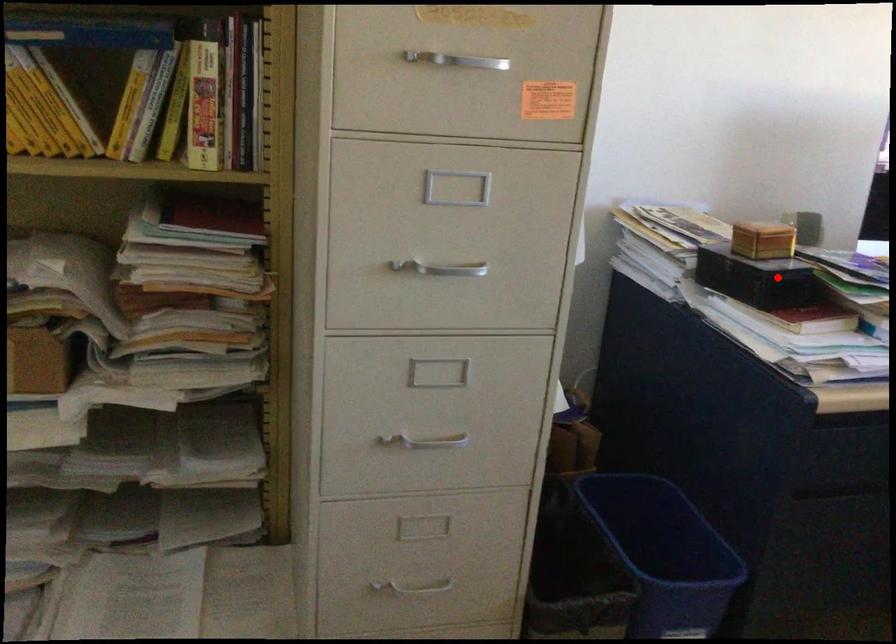
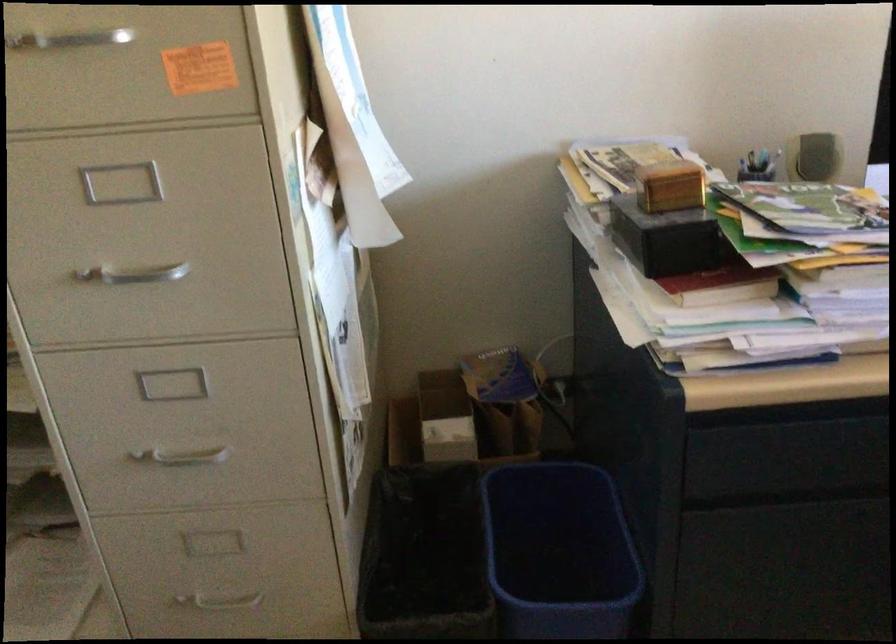
Question: A red point is marked in image1. In image2, is the corresponding 3D point closer to the camera or farther? Reply with the corresponding letter.

Choices:
 (A) The corresponding 3D point is closer.
 (B) The corresponding 3D point is farther.

Answer: (A)